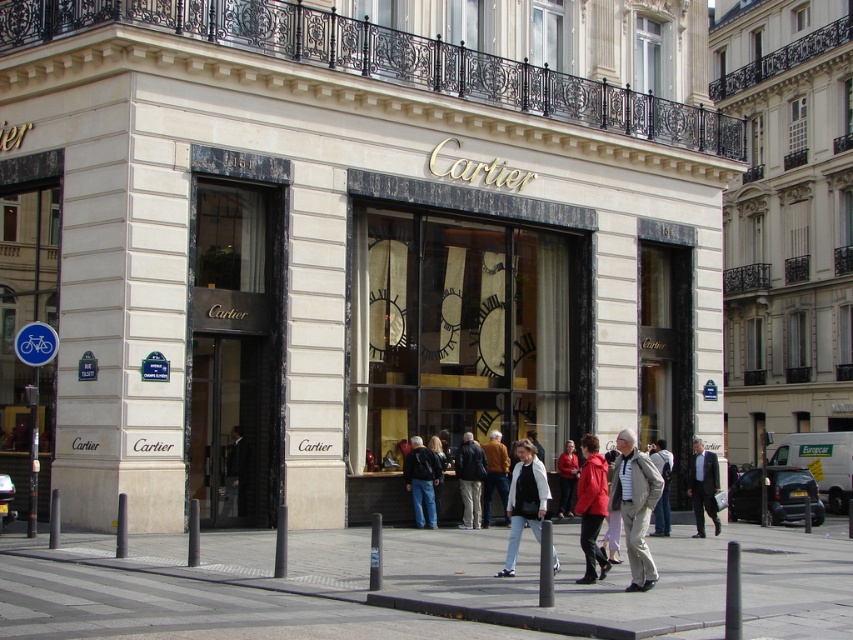
Is the position of gray concrete pavement at lower center more distant than that of dark blue jeans at center?

No, it is in front of dark blue jeans at center.

Does gray concrete pavement at lower center have a greater height compared to dark blue jeans at center?

Yes, gray concrete pavement at lower center is taller than dark blue jeans at center.

Which is behind, point (267, 573) or point (436, 465)?

The point (436, 465) is more distant.

At what (x,y) coordinates should I click in order to perform the action: click on gray concrete pavement at lower center. Please return your answer as a coordinate pair (x, y). Looking at the image, I should click on (415, 586).

Does dark blue jeans at center appear on the left side of dark brown leather jacket at center?

Indeed, dark blue jeans at center is positioned on the left side of dark brown leather jacket at center.

You are a GUI agent. You are given a task and a screenshot of the screen. Output one action in this format:
    pyautogui.click(x=<x>, y=<y>)
    Task: Click on the dark blue jeans at center
    
    Given the screenshot: What is the action you would take?
    (421, 481)

Is point (410, 484) closer to camera compared to point (462, 464)?

Yes, it is in front of point (462, 464).

Where is `dark blue jeans at center`? Image resolution: width=853 pixels, height=640 pixels. dark blue jeans at center is located at coordinates (421, 481).

Which is more to the right, matte gold clock at center or gray fabric jacket at center?

gray fabric jacket at center

Which is more to the left, matte gold clock at center or gray fabric jacket at center?

Positioned to the left is matte gold clock at center.

Who is more distant from viewer, (204, 252) or (645, 580)?

Point (204, 252)

Identify the location of matte gold clock at center. The image size is (853, 640). (351, 241).